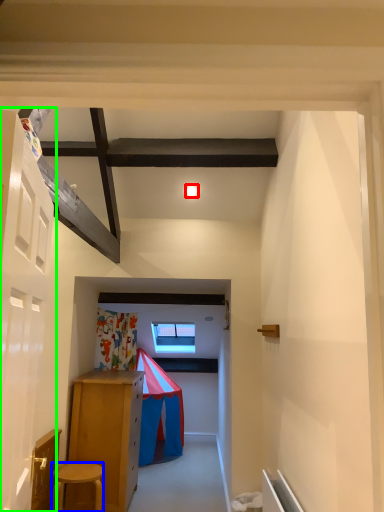
Question: Which object is positioned farthest from light (highlighted by a red box)? Select from stool (highlighted by a blue box) and door (highlighted by a green box).

Choices:
 (A) stool
 (B) door

Answer: (A)